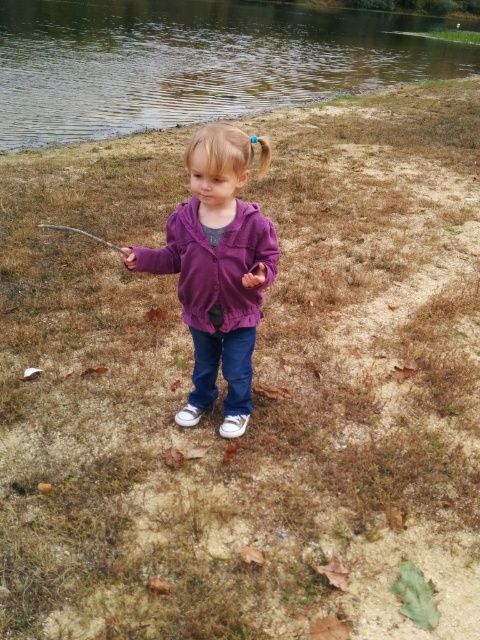
Question: Can you confirm if purple fleece sweatshirt at center is wider than brown wooden fishing pole at lower left?

Choices:
 (A) yes
 (B) no

Answer: (B)

Question: Which point is farther from the camera taking this photo?

Choices:
 (A) (261, 291)
 (B) (196, 344)
 (C) (104, 241)

Answer: (C)

Question: Is greenish reflective water at upper center wider than brown wooden fishing pole at lower left?

Choices:
 (A) no
 (B) yes

Answer: (B)

Question: Which of the following is the closest to the observer?

Choices:
 (A) click(82, 230)
 (B) click(204, 257)
 (C) click(365, 33)
 (D) click(192, 221)

Answer: (B)

Question: Does greenish reflective water at upper center appear on the left side of purple fleece jacket at center?

Choices:
 (A) no
 (B) yes

Answer: (A)

Question: Which of the following is the farthest from the observer?

Choices:
 (A) (178, 266)
 (B) (107, 243)

Answer: (B)